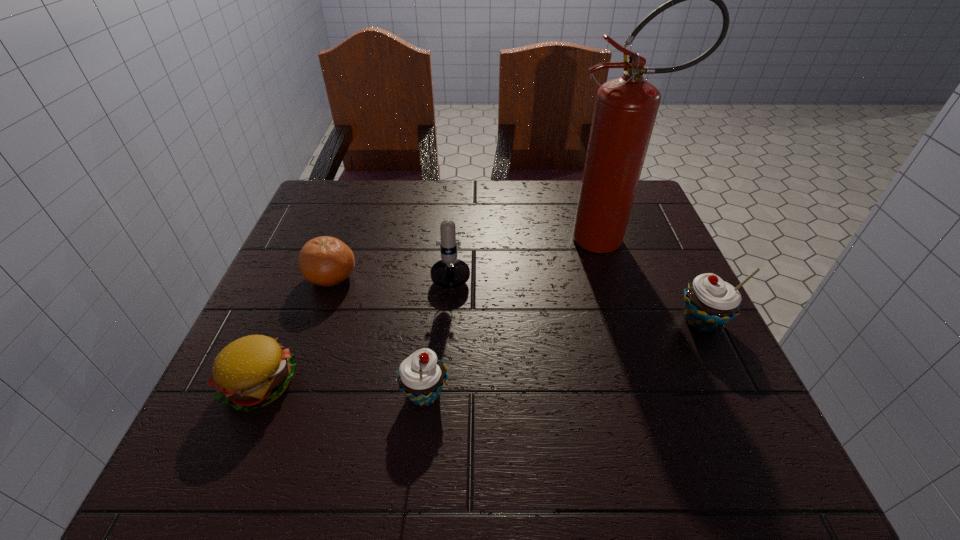
This screenshot has height=540, width=960. In order to click on vacant space located 0.110m on the front of the clementine in this screenshot , I will do `click(311, 336)`.

Find the location of a particular element. This screenshot has height=540, width=960. free spot located 0.260m from the nozzle of the fire extinguisher is located at coordinates (456, 239).

You are a GUI agent. You are given a task and a screenshot of the screen. Output one action in this format:
    pyautogui.click(x=<x>, y=<y>)
    Task: Click on the vacant space positioned 0.400m from the nozzle of the fire extinguisher
    
    Given the screenshot: What is the action you would take?
    pyautogui.click(x=399, y=239)

This screenshot has width=960, height=540. I want to click on blank space located 0.180m from the nozzle of the fire extinguisher, so click(489, 239).

Where is `free region located on the back of the microphone`? The width and height of the screenshot is (960, 540). free region located on the back of the microphone is located at coordinates (457, 198).

Where is `vacant space situated 0.110m on the back of the hamburger`? Image resolution: width=960 pixels, height=540 pixels. vacant space situated 0.110m on the back of the hamburger is located at coordinates (292, 311).

At what (x,y) coordinates should I click in order to perform the action: click on object located at the far edge. Please return your answer as a coordinate pair (x, y). The height and width of the screenshot is (540, 960). Looking at the image, I should click on (625, 110).

The height and width of the screenshot is (540, 960). I want to click on cupcake located in the near edge section of the desktop, so click(x=421, y=377).

Find the location of a particular element. hamburger that is positioned at the near edge is located at coordinates (253, 371).

Identify the location of clementine located at the left edge. (326, 261).